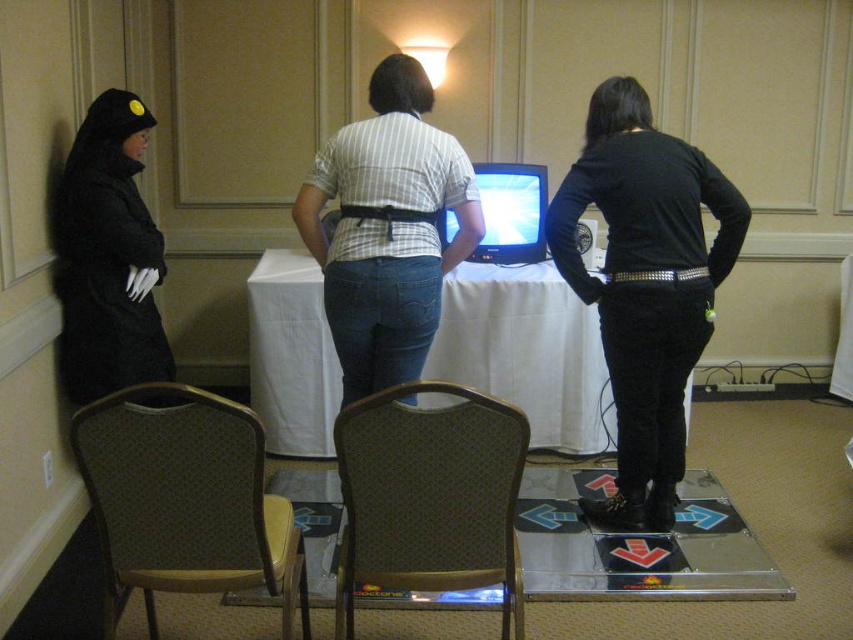
Question: Which point is closer to the camera?

Choices:
 (A) (91, 132)
 (B) (132, 577)
 (C) (573, 212)
 (D) (486, 184)

Answer: (B)

Question: Is the position of white cloth table at center more distant than that of white striped shirt at center?

Choices:
 (A) yes
 (B) no

Answer: (A)

Question: Which object appears farthest from the camera in this image?

Choices:
 (A) black matte coat at left
 (B) brown fabric chair at lower left
 (C) white striped shirt at center

Answer: (A)

Question: Is white striped shirt at center to the left of matte plastic television at center from the viewer's perspective?

Choices:
 (A) yes
 (B) no

Answer: (A)

Question: Is white cloth table at center to the right of brown fabric chair at lower left from the viewer's perspective?

Choices:
 (A) no
 (B) yes

Answer: (B)

Question: Which point is farther to the camera?

Choices:
 (A) brown fabric chair at lower center
 (B) black matte pants at center
 (C) matte plastic television at center
 (D) white cloth table at center

Answer: (D)